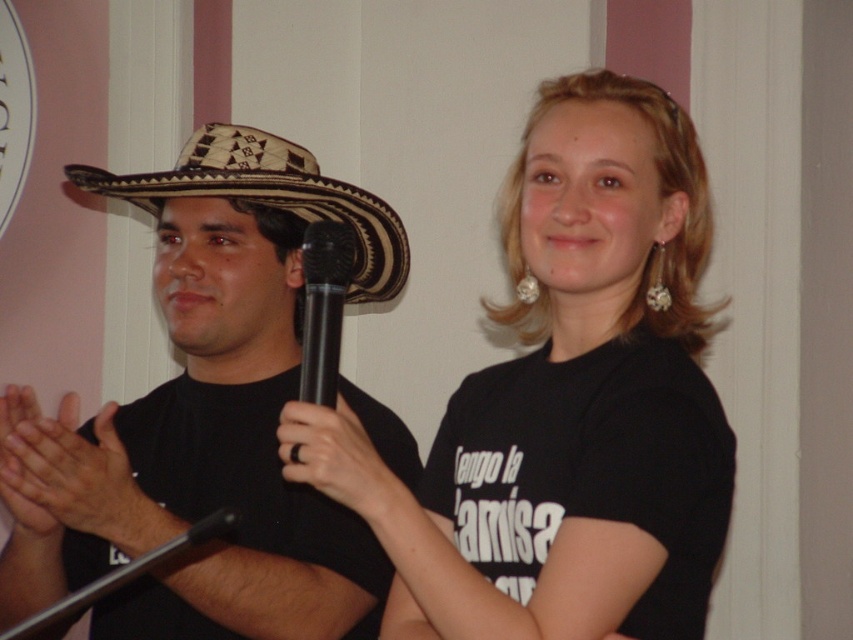
You are at a lively event and see the woven straw cowboy hat at left and the black plastic microphone at center. Which object is positioned further to the left?

The woven straw cowboy hat at left is positioned further to the left than the black plastic microphone at center.

Please describe the location of the smooth skin hands at center in terms of coordinates within the image frame. The answer should be in the format of coordinates in parentheses.

The smooth skin hands at center are located at coordinates point [73,486].

Based on the scene description, what is located at the coordinates point (73,486)?

At point (73,486) lies smooth skin hands at center.